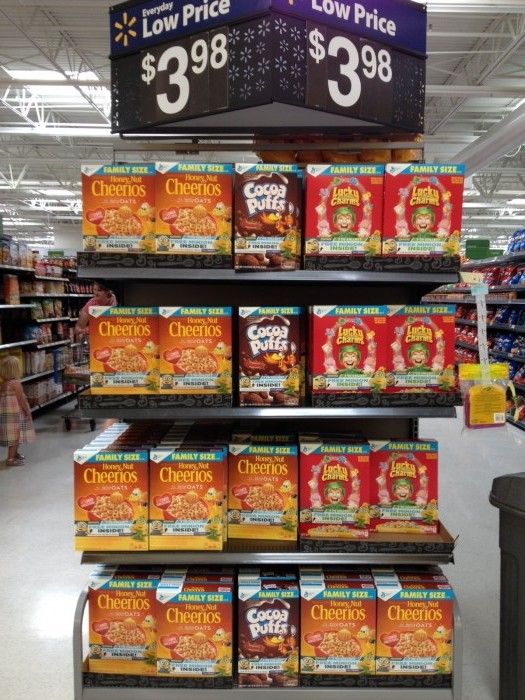
In order to click on lucky charms boxes in this screenshot , I will do `click(310, 449)`, `click(313, 439)`, `click(317, 432)`, `click(398, 446)`, `click(409, 330)`, `click(357, 330)`, `click(341, 218)`, `click(428, 217)`.